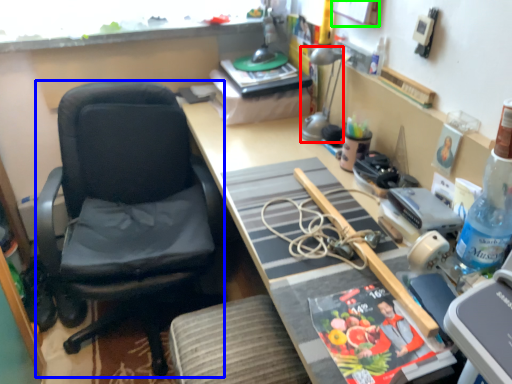
Question: Based on their relative distances, which object is farther from lamp (highlighted by a red box)? Choose from chair (highlighted by a blue box) and picture frame (highlighted by a green box).

Choices:
 (A) chair
 (B) picture frame

Answer: (A)